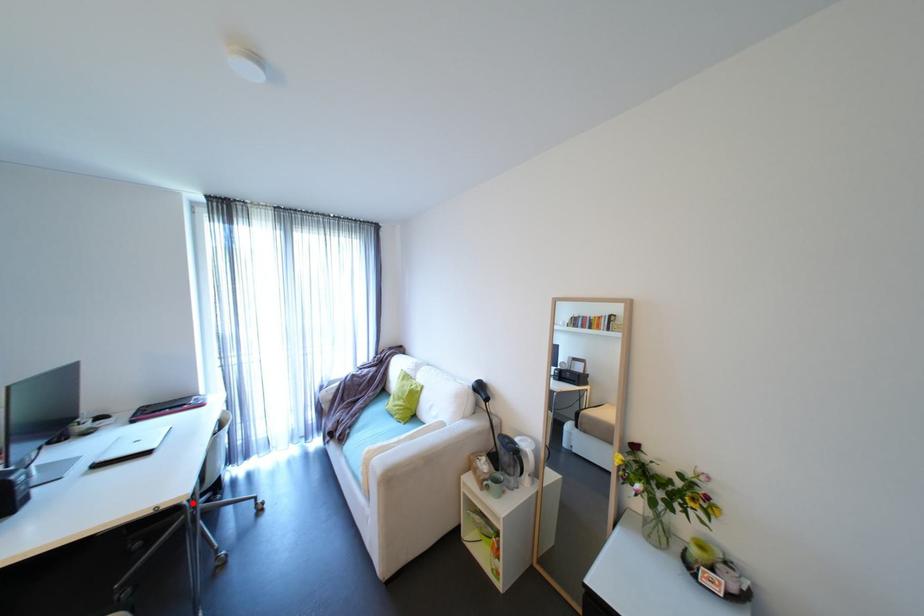
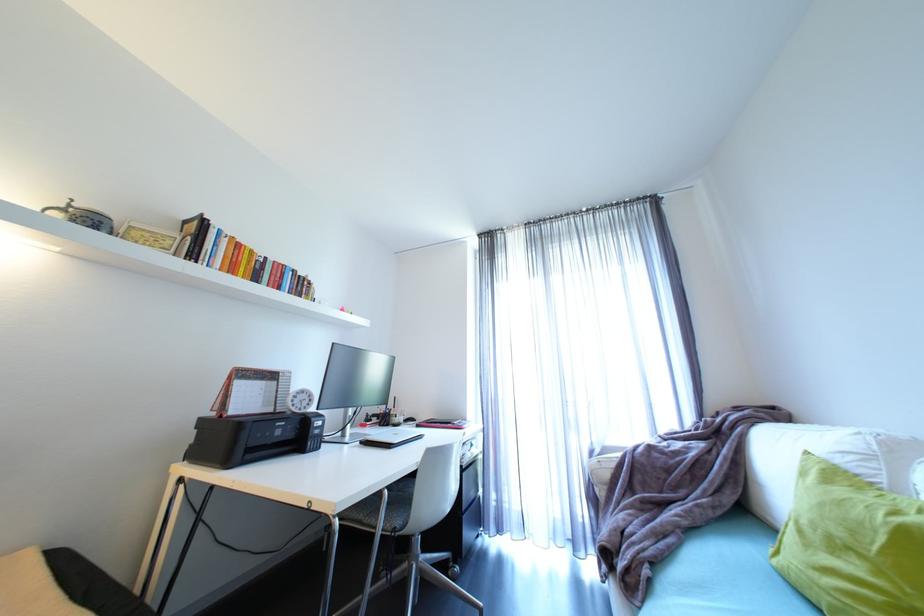
Question: I am providing you with two images of the same scene from different viewpoints. A red point is shown in image1. For the corresponding object point in image2, is it positioned nearer or farther from the camera?

Choices:
 (A) Nearer
 (B) Farther

Answer: (B)